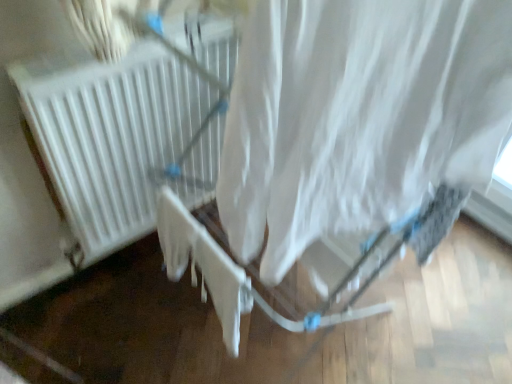
This screenshot has height=384, width=512. I want to click on white matte radiator at center, so click(x=130, y=128).

What is the approximate height of white matte radiator at center?

It is 27.38 inches.

What do you see at coordinates (130, 128) in the screenshot? I see `white matte radiator at center` at bounding box center [130, 128].

Image resolution: width=512 pixels, height=384 pixels. What do you see at coordinates (358, 116) in the screenshot? I see `white fabric curtain at center` at bounding box center [358, 116].

Where is `white fabric curtain at center`? The width and height of the screenshot is (512, 384). white fabric curtain at center is located at coordinates (358, 116).

You are a GUI agent. You are given a task and a screenshot of the screen. Output one action in this format:
    pyautogui.click(x=<x>, y=<y>)
    Task: Click on the white matte radiator at center
    This screenshot has height=384, width=512.
    Given the screenshot: What is the action you would take?
    pyautogui.click(x=130, y=128)

Would you say white fabric curtain at center is to the left or to the right of white matte radiator at center in the picture?

Clearly, white fabric curtain at center is on the right of white matte radiator at center in the image.

Is the depth of white fabric curtain at center less than that of white matte radiator at center?

Yes, white fabric curtain at center is closer to the viewer.

Between point (400, 207) and point (98, 70), which one is positioned in front?

The point (400, 207) is closer to the camera.

From the image's perspective, is white fabric curtain at center below white matte radiator at center?

Yes.

From a real-world perspective, is white fabric curtain at center positioned over white matte radiator at center based on gravity?

Indeed, from a real-world perspective, white fabric curtain at center stands above white matte radiator at center.

Which of these two, white fabric curtain at center or white matte radiator at center, is thinner?

With smaller width is white matte radiator at center.

Is white fabric curtain at center taller or shorter than white matte radiator at center?

white fabric curtain at center is shorter than white matte radiator at center.

Considering the sizes of objects white fabric curtain at center and white matte radiator at center in the image provided, who is smaller, white fabric curtain at center or white matte radiator at center?

Smaller between the two is white fabric curtain at center.

Is white fabric curtain at center positioned beyond the bounds of white matte radiator at center?

Indeed, white fabric curtain at center is completely outside white matte radiator at center.

In the scene shown: Are white fabric curtain at center and white matte radiator at center making contact?

There is a gap between white fabric curtain at center and white matte radiator at center.

Is white fabric curtain at center positioned with its back to white matte radiator at center?

No.

You are a GUI agent. You are given a task and a screenshot of the screen. Output one action in this format:
    pyautogui.click(x=<x>, y=<y>)
    Task: Click on the curtain below the white matte radiator at center (from the image's perspective)
    Image resolution: width=512 pixels, height=384 pixels.
    Given the screenshot: What is the action you would take?
    pyautogui.click(x=358, y=116)

Is white matte radiator at center to the left or to the right of white fabric curtain at center in the image?

white matte radiator at center is positioned on white fabric curtain at center's left side.

Looking at this image, is white matte radiator at center further to the viewer compared to white fabric curtain at center?

Yes, white matte radiator at center is further from the viewer.

Considering the positions of points (147, 183) and (380, 33), is point (147, 183) closer to camera compared to point (380, 33)?

No, (147, 183) is further to viewer.

From the image's perspective, is white matte radiator at center above or below white fabric curtain at center?

From the image's perspective, white matte radiator at center appears above white fabric curtain at center.

From a real-world perspective, which object rests below the other?

white matte radiator at center.

Considering the relative sizes of white matte radiator at center and white fabric curtain at center in the image provided, is white matte radiator at center thinner than white fabric curtain at center?

Correct, the width of white matte radiator at center is less than that of white fabric curtain at center.

From their relative heights in the image, would you say white matte radiator at center is taller or shorter than white fabric curtain at center?

Clearly, white matte radiator at center is taller compared to white fabric curtain at center.

Considering the sizes of white matte radiator at center and white fabric curtain at center in the image, is white matte radiator at center bigger or smaller than white fabric curtain at center?

Considering their sizes, white matte radiator at center takes up more space than white fabric curtain at center.

Choose the correct answer: Is white matte radiator at center inside white fabric curtain at center or outside it?

white matte radiator at center is not enclosed by white fabric curtain at center.

Is white matte radiator at center touching white fabric curtain at center?

white matte radiator at center is not next to white fabric curtain at center, and they're not touching.

Is white fabric curtain at center at the back of white matte radiator at center?

white matte radiator at center is not turned away from white fabric curtain at center.

How far apart are white matte radiator at center and white fabric curtain at center?

white matte radiator at center and white fabric curtain at center are 28.32 inches apart.

Where is `curtain lying below the white matte radiator at center (from the image's perspective)`? The height and width of the screenshot is (384, 512). curtain lying below the white matte radiator at center (from the image's perspective) is located at coordinates (358, 116).

This screenshot has width=512, height=384. I want to click on heater below the white fabric curtain at center (from a real-world perspective), so click(130, 128).

The width and height of the screenshot is (512, 384). What are the coordinates of `heater behind the white fabric curtain at center` in the screenshot? It's located at (130, 128).